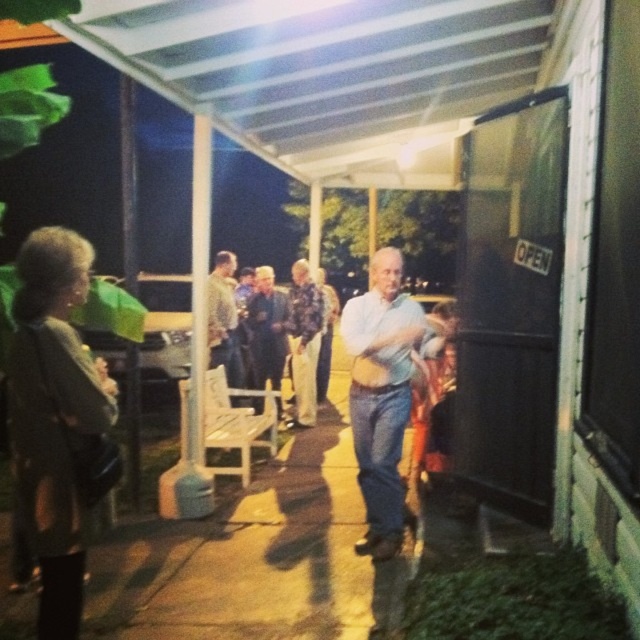
You are at the nighttime gathering under the porch and want to find the person wearing the light blue jeans at center. Which direction should you look relative to the light brown leather jacket at center?

The light blue jeans at center is to the right of the light brown leather jacket at center, so you should look to the right side of the light brown leather jacket at center to find the light blue jeans at center.